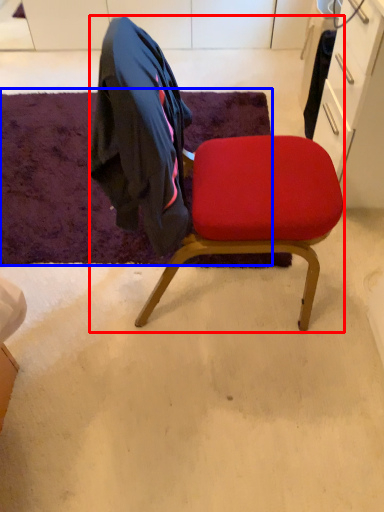
Question: Which point is further to the camera, chair (highlighted by a red box) or mat (highlighted by a blue box)?

Choices:
 (A) chair
 (B) mat

Answer: (B)